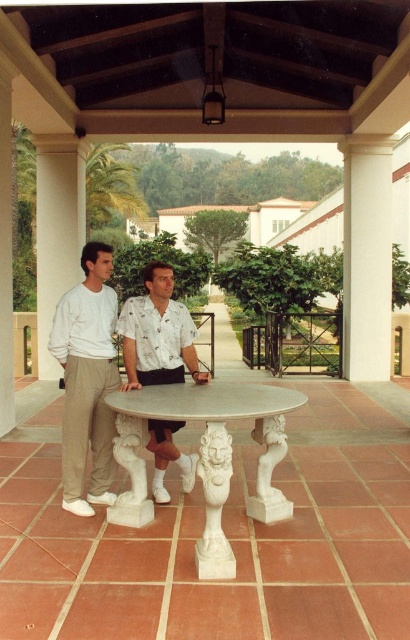
You are a delivery person trying to place a large rectangular package that measures 12 inches in length. You need to position it between the white marble table at center and the white marble lion at center. Is there enough space between them to fit the package?

The white marble table at center and the white marble lion at center are 12.43 inches apart, so the package measuring 12 inches in length can fit between them since the distance is slightly larger than the package.

You are standing at the entrance of the patio and want to place a new potted plant exactly at the center of the patio. The existing white marble table at center is located at coordinates 0.678 on the x axis and 0.507 on the y axis. Is the table already positioned at the center of the patio?

The white marble table at center is located at coordinates 0.678 on the x axis and 0.507 on the y axis. Since the center of the patio would be at coordinates (205, 320), the table is slightly shifted to the right and slightly lower than the true center.

You are planning to place a decorative vase on the white marble table at center. Considering the size of the white stone lion at center, will the vase fit on the table?

The white marble table at center is larger in size compared to the white stone lion at center, so the vase should fit comfortably on the table.